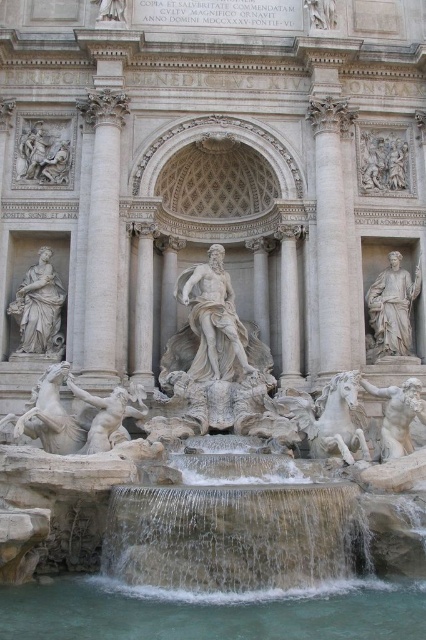
You are standing in front of the Trevi Fountain and want to take a photo of the white marble column at upper right. If your camera has a maximum zoom range of 50 meters, will you be able to capture the column clearly without moving closer?

The white marble column at upper right is 62.81 meters away from the viewer. Since the camera can only zoom up to 50 meters, you won cannot capture the column clearly without moving closer.

You are standing in front of the Trevi Fountain and want to take a photo. You notice two points in the scene labeled as point 1 and point 2. Point 1 is at coordinates (37, 353) and point 2 is at (146, 266). Which point is closer to you?

Point 1 is closer to the viewer than point 2.